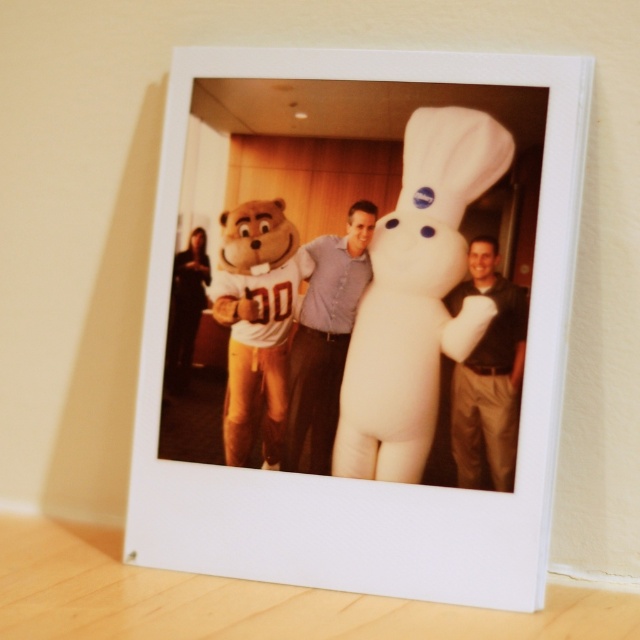
At what (x,y) coordinates should I click in order to perform the action: click on white matte photo frame at center. Please return your answer as a coordinate pair (x, y). The width and height of the screenshot is (640, 640). Looking at the image, I should click on (356, 480).

Which of these two, white matte photo frame at center or orange plush teddy bear at center, stands shorter?

With less height is orange plush teddy bear at center.

Which is in front, point (474, 586) or point (227, 458)?

Point (474, 586) is more forward.

The height and width of the screenshot is (640, 640). Find the location of `white matte photo frame at center`. white matte photo frame at center is located at coordinates (356, 480).

Is orange plush teddy bear at center to the left of dark brown leather jacket at center from the viewer's perspective?

Correct, you'll find orange plush teddy bear at center to the left of dark brown leather jacket at center.

Can you confirm if orange plush teddy bear at center is bigger than dark brown leather jacket at center?

Yes.

You are a GUI agent. You are given a task and a screenshot of the screen. Output one action in this format:
    pyautogui.click(x=<x>, y=<y>)
    Task: Click on the orange plush teddy bear at center
    The height and width of the screenshot is (640, 640).
    Given the screenshot: What is the action you would take?
    pyautogui.click(x=257, y=323)

Identify the location of orange plush teddy bear at center. (257, 323).

Does white matte photo frame at center appear over matte blue shirt at center?

Yes.

Does point (205, 525) come farther from viewer compared to point (371, 269)?

No, (205, 525) is closer to viewer.

You are a GUI agent. You are given a task and a screenshot of the screen. Output one action in this format:
    pyautogui.click(x=<x>, y=<y>)
    Task: Click on the white matte photo frame at center
    The width and height of the screenshot is (640, 640).
    Given the screenshot: What is the action you would take?
    pyautogui.click(x=356, y=480)